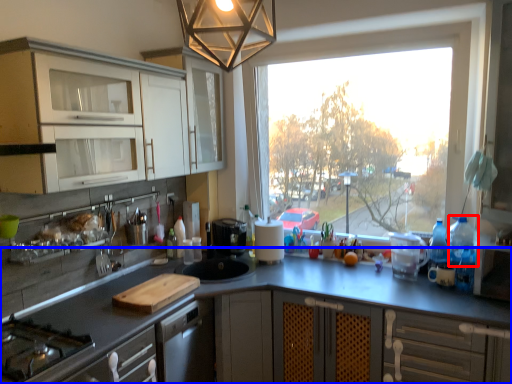
Question: Which point is further to the camera, appliance (highlighted by a red box) or countertop (highlighted by a blue box)?

Choices:
 (A) appliance
 (B) countertop

Answer: (A)